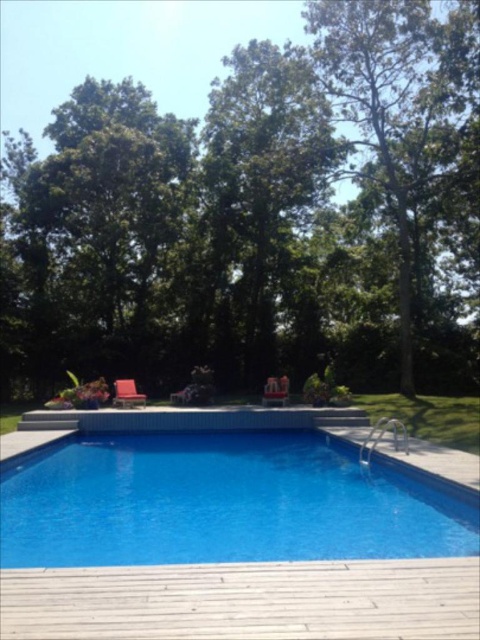
In the scene shown: Is the position of metallic red chair at center less distant than that of metallic silver chair at center?

That is True.

At what (x,y) coordinates should I click in order to perform the action: click on metallic red chair at center. Please return your answer as a coordinate pair (x, y). Looking at the image, I should click on (276, 390).

Does blue tile swimming pool at center appear over metallic silver chair at center?

Incorrect, blue tile swimming pool at center is not positioned above metallic silver chair at center.

Consider the image. Who is shorter, blue tile swimming pool at center or metallic silver chair at center?

metallic silver chair at center

Is point (148, 480) positioned before point (178, 400)?

That is True.

Locate an element on the screen. Image resolution: width=480 pixels, height=640 pixels. blue tile swimming pool at center is located at coordinates (219, 502).

Who is more distant from viewer, (x=243, y=260) or (x=279, y=529)?

The point (x=243, y=260) is behind.

Is green leafy tree at upper center above blue tile swimming pool at center?

Yes, green leafy tree at upper center is above blue tile swimming pool at center.

The image size is (480, 640). In order to click on green leafy tree at upper center in this screenshot , I will do `click(259, 216)`.

Identify the location of green leafy tree at upper center. This screenshot has height=640, width=480. (259, 216).